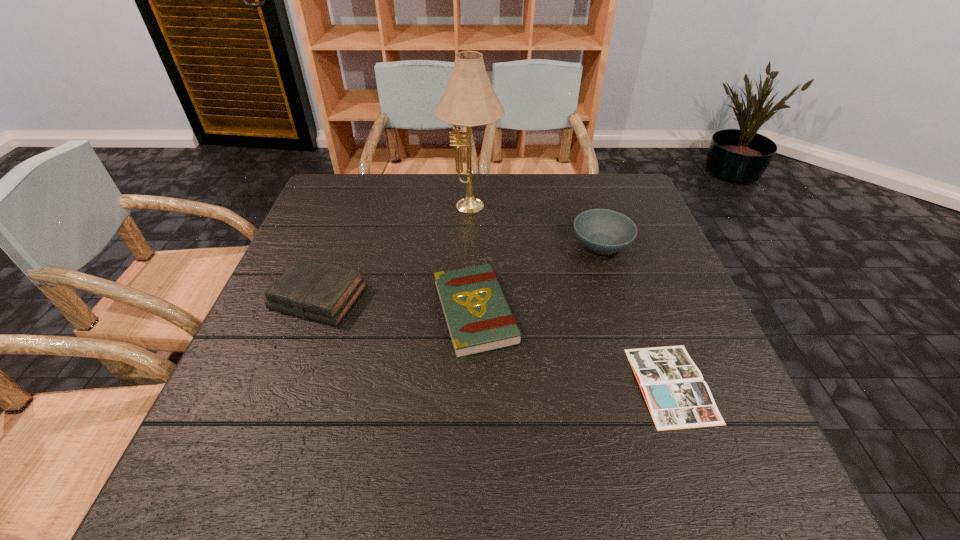
This screenshot has width=960, height=540. Identify the location of vacant area at the right edge. (619, 261).

Identify the location of vacant space at the far right corner. The width and height of the screenshot is (960, 540). (637, 214).

The image size is (960, 540). I want to click on free region at the near right corner of the desktop, so click(764, 477).

Where is `vacant space that's between the second book from right to left and the second tallest object`? This screenshot has height=540, width=960. vacant space that's between the second book from right to left and the second tallest object is located at coordinates (539, 279).

The height and width of the screenshot is (540, 960). Find the location of `vacant region between the tallest object and the leftmost object`. vacant region between the tallest object and the leftmost object is located at coordinates (396, 253).

This screenshot has height=540, width=960. I want to click on vacant area that lies between the soup bowl and the shortest object, so click(636, 315).

Where is `unoccupied position between the lampshade and the rightmost book`? unoccupied position between the lampshade and the rightmost book is located at coordinates (571, 297).

Identify the location of empty space between the fourth shortest object and the shortest object. Image resolution: width=960 pixels, height=540 pixels. (636, 315).

Where is `free space between the leftmost book and the second shortest book`? free space between the leftmost book and the second shortest book is located at coordinates (397, 305).

Select which object is the second closest to the fourth tallest object. Please provide its 2D coordinates. Your answer should be formatted as a tuple, i.e. [(x, y)], where the tuple contains the x and y coordinates of a point satisfying the conditions above.

[(320, 291)]